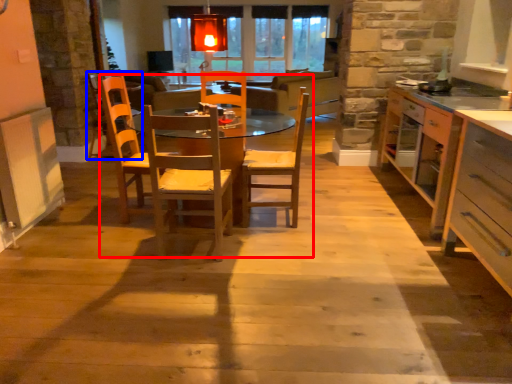
Question: Which of the following is the closest to the observer, kitchen & dining room table (highlighted by a red box) or armchair (highlighted by a blue box)?

Choices:
 (A) kitchen & dining room table
 (B) armchair

Answer: (A)